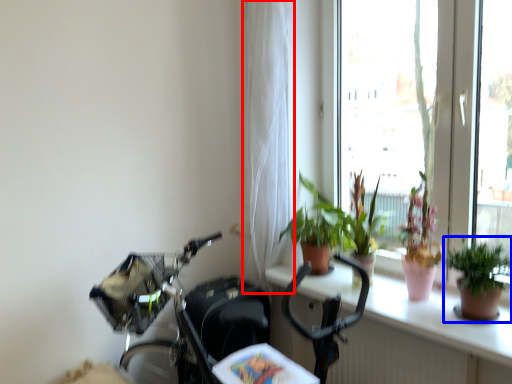
Question: Which point is closer to the camera, curtain (highlighted by a red box) or houseplant (highlighted by a blue box)?

Choices:
 (A) curtain
 (B) houseplant

Answer: (B)